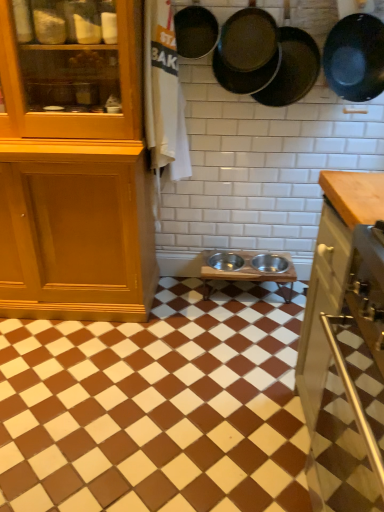
Question: Which direction should I rotate to face matte black frying pan at upper center, the first frying pan viewed from the left, — up or down?

Choices:
 (A) down
 (B) up

Answer: (B)

Question: Considering the relative positions of metallic silver bowls at center and matte black frying pan at upper center, the first frying pan viewed from the left, in the image provided, is metallic silver bowls at center to the left of matte black frying pan at upper center, the first frying pan viewed from the left, from the viewer's perspective?

Choices:
 (A) yes
 (B) no

Answer: (A)

Question: From the image's perspective, is metallic silver bowls at center beneath matte black frying pan at upper center, the first frying pan viewed from the left?

Choices:
 (A) no
 (B) yes

Answer: (B)

Question: Does metallic silver bowls at center have a greater width compared to matte black frying pan at upper center, the first frying pan viewed from the left?

Choices:
 (A) yes
 (B) no

Answer: (A)

Question: Is matte black frying pan at upper center, which appears as the fourth frying pan when viewed from the right, inside metallic silver bowls at center?

Choices:
 (A) yes
 (B) no

Answer: (B)

Question: Is metallic silver bowls at center further to camera compared to matte black frying pan at upper center, which appears as the fourth frying pan when viewed from the right?

Choices:
 (A) yes
 (B) no

Answer: (B)

Question: Considering the relative sizes of metallic silver bowls at center and matte black frying pan at upper center, the first frying pan viewed from the left, in the image provided, is metallic silver bowls at center thinner than matte black frying pan at upper center, the first frying pan viewed from the left,?

Choices:
 (A) yes
 (B) no

Answer: (B)

Question: Is matte black frying pan at upper right, which is counted as the 3th frying pan, starting from the left, to the left of metallic silver bowls at center from the viewer's perspective?

Choices:
 (A) no
 (B) yes

Answer: (A)

Question: Is matte black frying pan at upper right, the second frying pan in the right-to-left sequence, outside metallic silver bowls at center?

Choices:
 (A) no
 (B) yes

Answer: (B)

Question: Is matte black frying pan at upper right, which is counted as the 3th frying pan, starting from the left, with metallic silver bowls at center?

Choices:
 (A) yes
 (B) no

Answer: (B)

Question: From a real-world perspective, is matte black frying pan at upper right, which is counted as the 3th frying pan, starting from the left, located beneath metallic silver bowls at center?

Choices:
 (A) yes
 (B) no

Answer: (B)

Question: From the image's perspective, is matte black frying pan at upper right, the second frying pan in the right-to-left sequence, located beneath metallic silver bowls at center?

Choices:
 (A) yes
 (B) no

Answer: (B)

Question: Is matte black frying pan at upper right, which is counted as the 3th frying pan, starting from the left, positioned in front of metallic silver bowls at center?

Choices:
 (A) yes
 (B) no

Answer: (B)

Question: From the image's perspective, does black matte frying pan at upper right, the 4th frying pan viewed from the left, appear lower than metallic silver bowls at center?

Choices:
 (A) yes
 (B) no

Answer: (B)